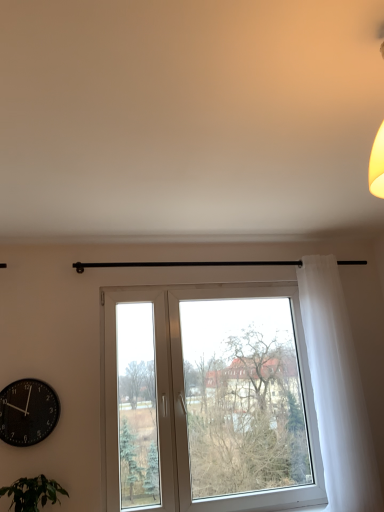
Where is `white plastic window at center`? white plastic window at center is located at coordinates (208, 400).

I want to click on black matte wall clock at lower left, so click(27, 412).

At what (x,y) coordinates should I click in order to perform the action: click on white plastic window at center. Please return your answer as a coordinate pair (x, y). Looking at the image, I should click on (208, 400).

Is black matte wall clock at lower left thinner than white plastic window at center?

Correct, the width of black matte wall clock at lower left is less than that of white plastic window at center.

Identify the location of wall clock below the white plastic window at center (from the image's perspective). Image resolution: width=384 pixels, height=512 pixels. (27, 412).

Does point (9, 390) come in front of point (200, 508)?

That is True.

Do you think black matte wall clock at lower left is within white plastic window at center, or outside of it?

black matte wall clock at lower left exists outside the volume of white plastic window at center.

Is white sheer curtain at right shorter than green leafy plant at lower left?

No, white sheer curtain at right is not shorter than green leafy plant at lower left.

From the picture: Could you tell me if white sheer curtain at right is turned towards green leafy plant at lower left?

No.

Would you say white sheer curtain at right contains green leafy plant at lower left?

Actually, green leafy plant at lower left is outside white sheer curtain at right.

Between point (14, 490) and point (238, 314), which one is positioned in front?

The point (14, 490) is closer to the camera.

From a real-world perspective, who is located higher, green leafy plant at lower left or white plastic window at center?

From a 3D spatial view, white plastic window at center is above.

Considering the relative positions of green leafy plant at lower left and white plastic window at center in the image provided, is green leafy plant at lower left in front of white plastic window at center?

Yes, the depth of green leafy plant at lower left is less than that of white plastic window at center.

Where is `wall clock that is on the left side of white sheer curtain at right`? wall clock that is on the left side of white sheer curtain at right is located at coordinates (27, 412).

Between white sheer curtain at right and black matte wall clock at lower left, which one appears on the left side from the viewer's perspective?

black matte wall clock at lower left is more to the left.

Is white sheer curtain at right placed right next to black matte wall clock at lower left?

white sheer curtain at right and black matte wall clock at lower left are clearly separated.

Find the location of `window that appears below the white sheer curtain at right (from the image's perspective)`. window that appears below the white sheer curtain at right (from the image's perspective) is located at coordinates (208, 400).

Is white sheer curtain at right bigger than white plastic window at center?

No.

Considering the positions of objects white sheer curtain at right and white plastic window at center in the image provided, who is behind, white sheer curtain at right or white plastic window at center?

white sheer curtain at right is behind.

Consider the image. In terms of height, does white sheer curtain at right look taller or shorter compared to white plastic window at center?

Clearly, white sheer curtain at right is taller compared to white plastic window at center.

From a real-world perspective, is white plastic window at center physically located above or below black matte wall clock at lower left?

Clearly, from a real-world perspective, white plastic window at center is above black matte wall clock at lower left.

From the image's perspective, is white plastic window at center on black matte wall clock at lower left?

Correct, white plastic window at center appears higher than black matte wall clock at lower left in the image.

Are white plastic window at center and black matte wall clock at lower left beside each other?

No, white plastic window at center is not in contact with black matte wall clock at lower left.

This screenshot has width=384, height=512. In order to click on window on the right of black matte wall clock at lower left in this screenshot , I will do [208, 400].

From the picture: Is white plastic window at center positioned far away from green leafy plant at lower left?

No, white plastic window at center is not far away from green leafy plant at lower left.

Is point (108, 315) less distant than point (37, 509)?

No, (108, 315) is behind (37, 509).

From a real-world perspective, is white plastic window at center over green leafy plant at lower left?

Yes, from a real-world perspective, white plastic window at center is over green leafy plant at lower left

Identify the location of window behind the black matte wall clock at lower left. The height and width of the screenshot is (512, 384). (208, 400).

Identify the location of curtain on the right of the green leafy plant at lower left. (337, 390).

Estimate the real-world distances between objects in this image. Which object is further from black matte wall clock at lower left, green leafy plant at lower left or white sheer curtain at right?

white sheer curtain at right is further to black matte wall clock at lower left.

Which object lies nearer to the anchor point black matte wall clock at lower left, white sheer curtain at right or white plastic window at center?

Based on the image, white plastic window at center appears to be nearer to black matte wall clock at lower left.

When comparing their distances from black matte wall clock at lower left, does green leafy plant at lower left or white plastic window at center seem further?

white plastic window at center is further to black matte wall clock at lower left.

When comparing their distances from green leafy plant at lower left, does white plastic window at center or white sheer curtain at right seem closer?

Based on the image, white plastic window at center appears to be nearer to green leafy plant at lower left.

Looking at the image, which one is located closer to white plastic window at center, green leafy plant at lower left or white sheer curtain at right?

white sheer curtain at right lies closer to white plastic window at center than the other object.

From the picture: Which object lies nearer to the anchor point white plastic window at center, black matte wall clock at lower left or green leafy plant at lower left?

black matte wall clock at lower left is positioned closer to the anchor white plastic window at center.

When comparing their distances from white sheer curtain at right, does black matte wall clock at lower left or white plastic window at center seem closer?

The object closer to white sheer curtain at right is white plastic window at center.

Looking at this image, based on their spatial positions, is white sheer curtain at right or black matte wall clock at lower left closer to green leafy plant at lower left?

black matte wall clock at lower left is positioned closer to the anchor green leafy plant at lower left.

Find the location of `window between green leafy plant at lower left and white sheer curtain at right from left to right`. window between green leafy plant at lower left and white sheer curtain at right from left to right is located at coordinates click(208, 400).

Find the location of a particular element. houseplant between black matte wall clock at lower left and white sheer curtain at right is located at coordinates (32, 493).

Locate an element on the screen. The width and height of the screenshot is (384, 512). houseplant located between black matte wall clock at lower left and white plastic window at center in the left-right direction is located at coordinates (32, 493).

Find the location of a particular element. window between black matte wall clock at lower left and white sheer curtain at right is located at coordinates (208, 400).